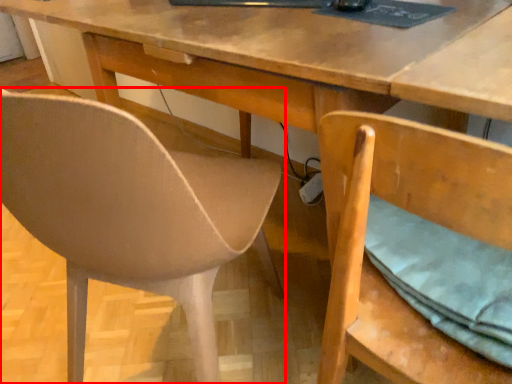
Question: Observing the image, what is the correct spatial positioning of chair (annotated by the red box) in reference to chair?

Choices:
 (A) left
 (B) right

Answer: (A)